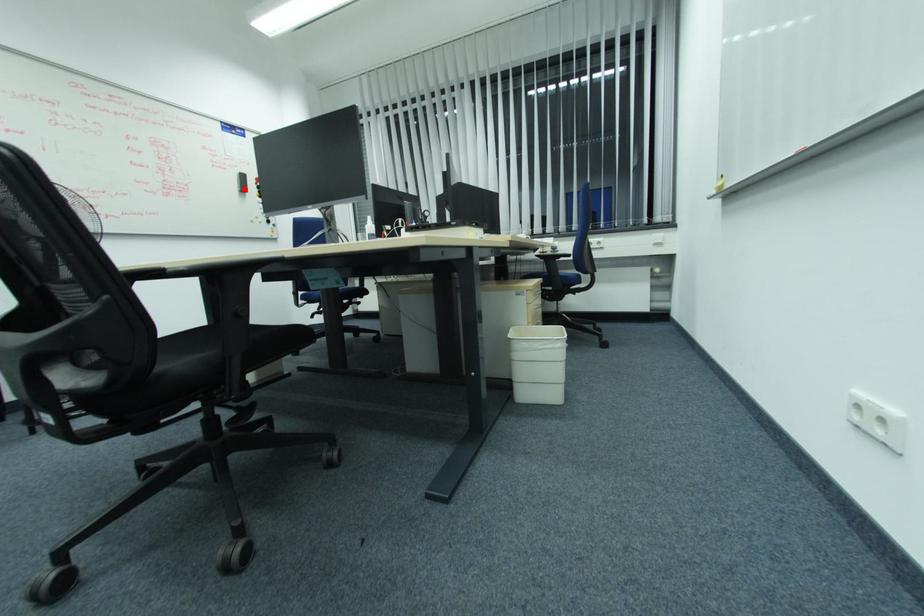
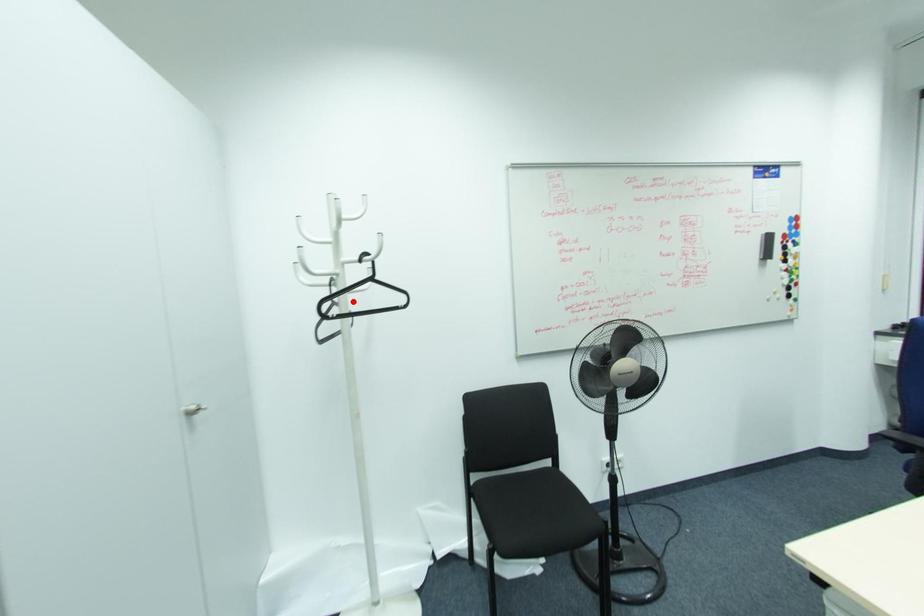
I am providing you with two images of the same scene from different viewpoints. A red point is marked on the first image and another point is marked on the second image. Is the marked point in image1 the same physical position as the marked point in image2?

No